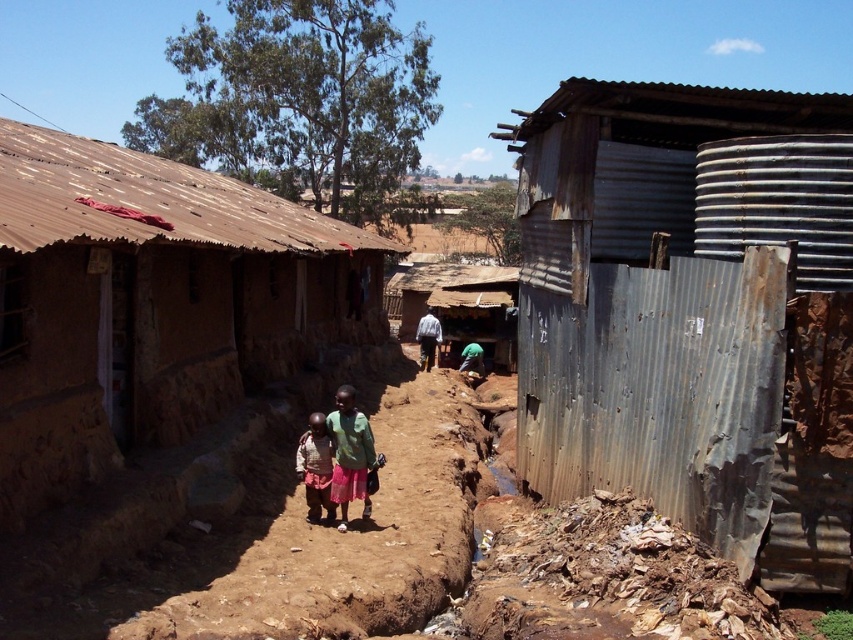
Consider the image. You are a delivery person with a cart that is 2 meters wide. You need to pass between the rusty corrugated metal hut at right and the green fabric shirt at center. Is there enough space for your cart?

The distance between the rusty corrugated metal hut at right and the green fabric shirt at center is 3.79 meters. Since your cart is 2 meters wide, there is sufficient space to pass through.

You are a traveler walking along the path and notice the thatched mud hut at center and the light brown fabric skirt at center. Which object is positioned higher in the image?

The thatched mud hut at center is above the light brown fabric skirt at center, so it is positioned higher in the image.

Consider the image. Based on the scene described, where is the rusty corrugated metal hut at right located in terms of its 2D coordinates?

The rusty corrugated metal hut at right is located at the 2D coordinates of point (693, 314).